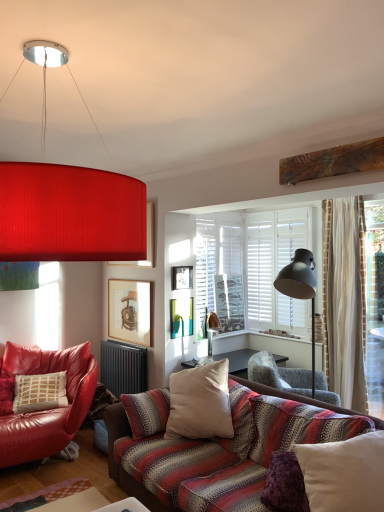
Question: Considering the positions of wooden picture frame at center, which appears as the 2th picture frame when ordered from the bottom, and wooden framed picture of chair at center, the third picture frame when ordered from top to bottom, in the image, is wooden picture frame at center, which appears as the 2th picture frame when ordered from the bottom, wider or thinner than wooden framed picture of chair at center, the third picture frame when ordered from top to bottom,?

Choices:
 (A) wide
 (B) thin

Answer: (A)

Question: From the image's perspective, relative to wooden framed picture of chair at center, the third picture frame when ordered from top to bottom, is wooden picture frame at center, which appears as the 2th picture frame when ordered from the bottom, above or below?

Choices:
 (A) above
 (B) below

Answer: (A)

Question: Which is farther from the striped fabric chair at center, arranged as the first chair when viewed from the right?

Choices:
 (A) matte red lampshade at upper center
 (B) leather chair at left, placed as the first chair when sorted from left to right
 (C) matte wooden picture frame at upper center, the 3th picture frame when ordered from bottom to top
 (D) white cotton cushion at center
 (E) matte black floor lamp at right

Answer: (A)

Question: Based on their relative distances, which object is nearer to the matte black floor lamp at right?

Choices:
 (A) striped fabric chair at center, arranged as the first chair when viewed from the right
 (B) matte red lampshade at upper center
 (C) matte wooden picture frame at upper center, the 3th picture frame when ordered from bottom to top
 (D) white cotton cushion at center
 (E) wooden picture frame at center, which appears as the 2th picture frame when ordered from the bottom

Answer: (A)